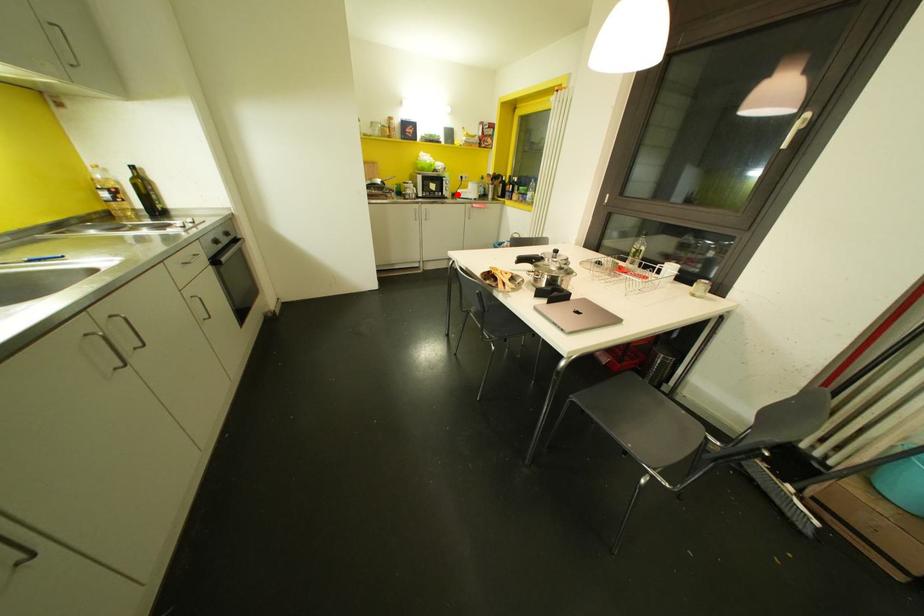
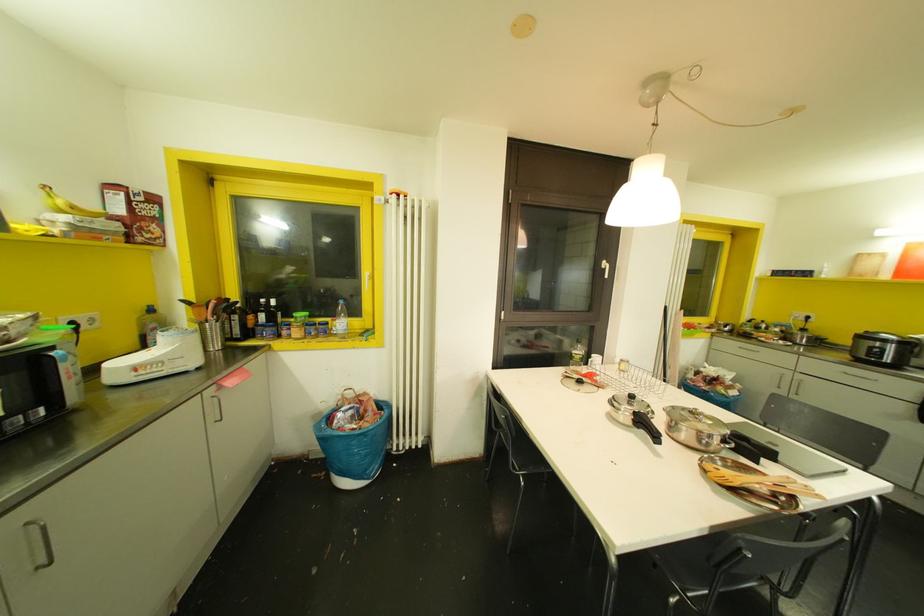
Question: I am providing you with two images of the same scene from different viewpoints. A red point is shown in image1. For the corresponding object point in image2, is it positioned nearer or farther from the camera?

Choices:
 (A) Nearer
 (B) Farther

Answer: (B)